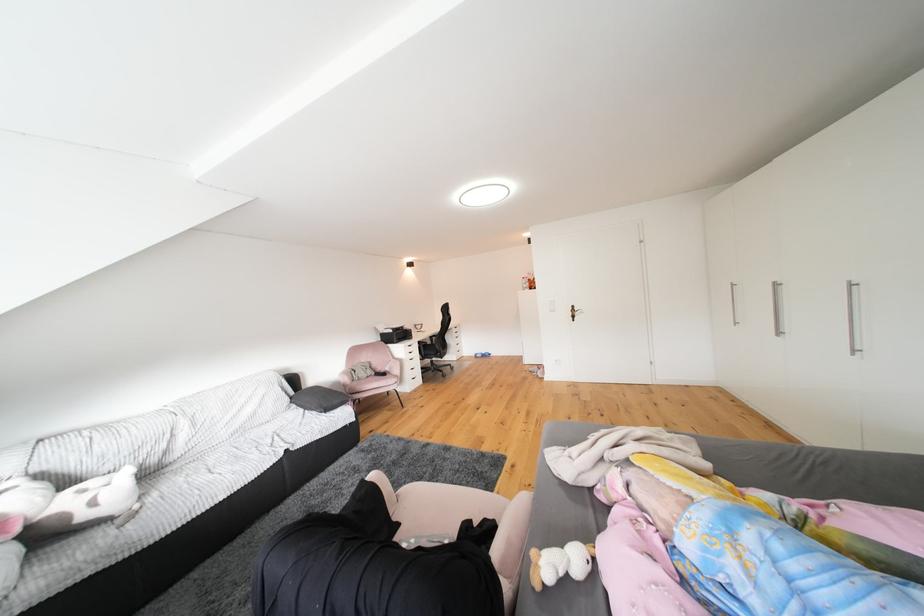
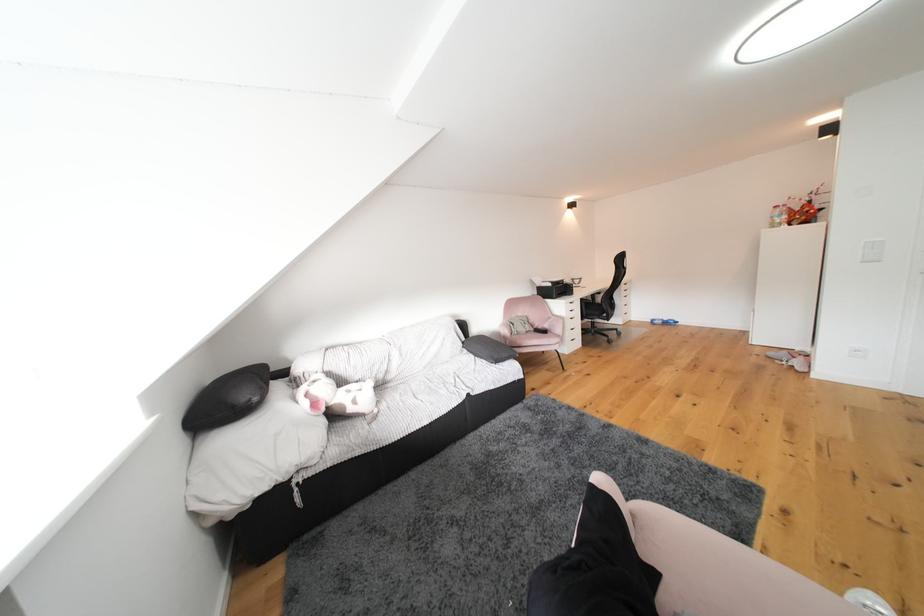
Where in the second image is the point corresponding to point (411, 331) from the first image?

(572, 285)